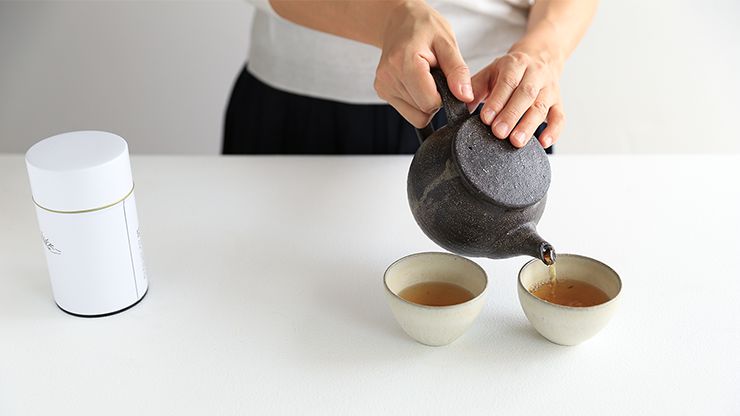
Image resolution: width=740 pixels, height=416 pixels. What are the coordinates of `white countertop` in the screenshot? It's located at coord(222,264), coord(343,251), coord(682,203).